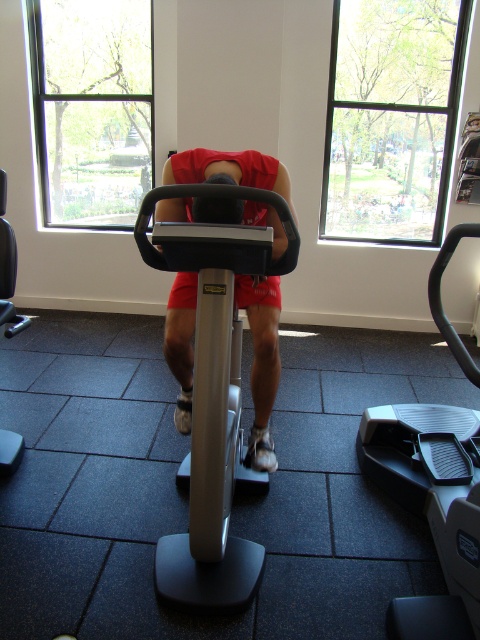
Between gray rubber tread at center and metallic silver exercise bike at center, which one appears on the right side from the viewer's perspective?

gray rubber tread at center is more to the right.

Identify the location of gray rubber tread at center. The image size is (480, 640). (432, 506).